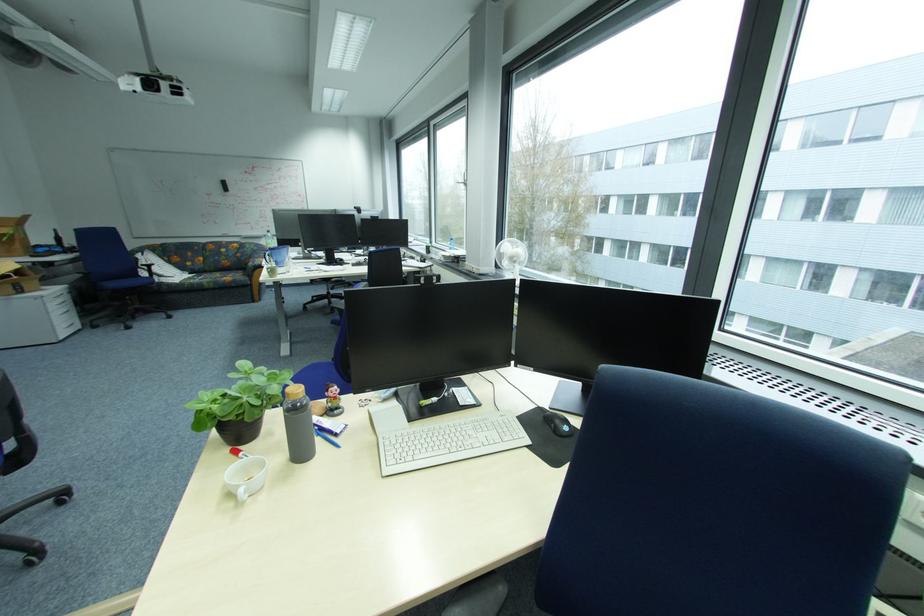
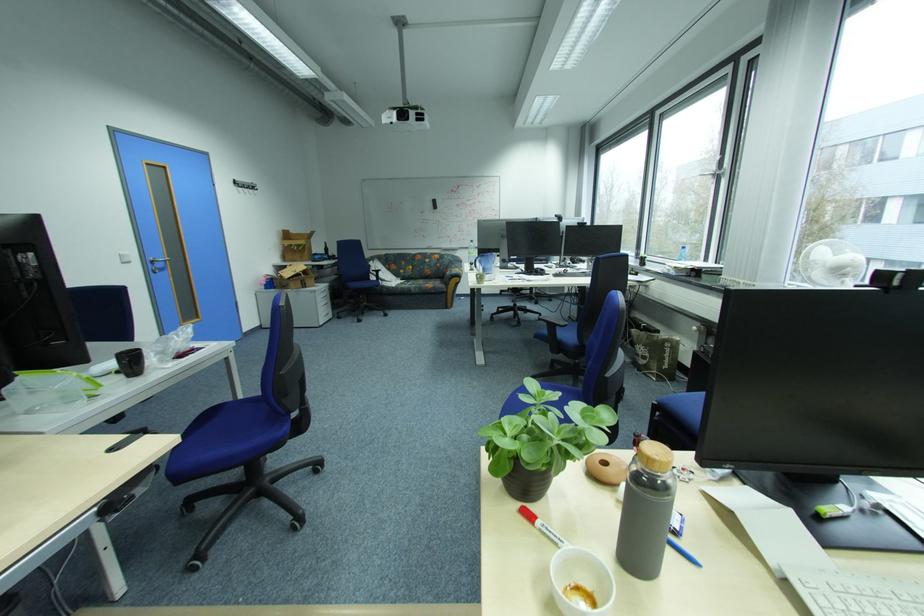
Question: The camera is either moving clockwise (left) or counter-clockwise (right) around the object. The first image is from the beginning of the video and the second image is from the end. Is the camera moving left or right when shooting the video?

Choices:
 (A) Left
 (B) Right

Answer: (B)